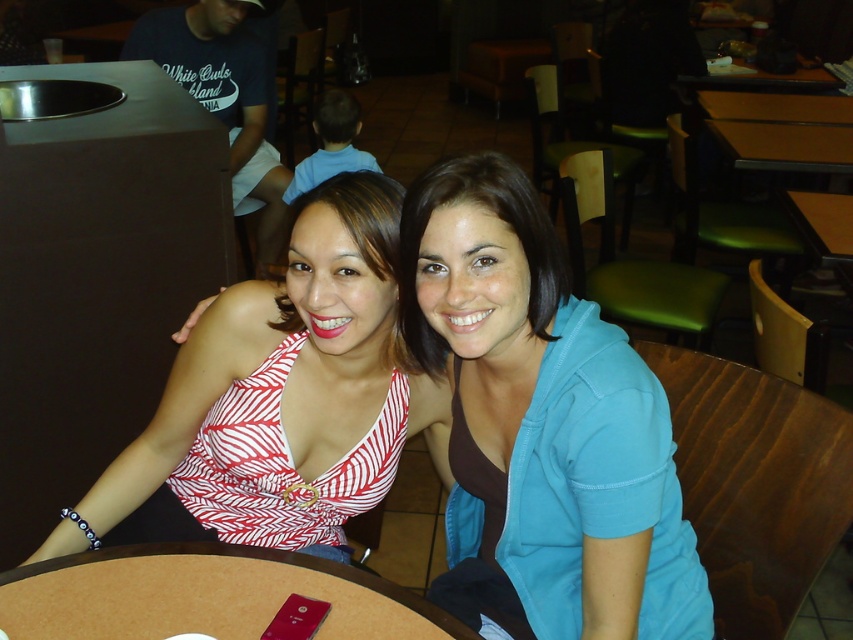
You are standing in front of the table where the two women are sitting. There is a small red object on the table at point (x=193, y=620). If you want to reach that object without moving your feet, can you do it if your arm can extend 36 inches?

The distance between point (x=193, y=620) and the camera is 38.70 inches. Since your arm can only extend 36 inches, you cannot reach the small red object at point (x=193, y=620) without moving your feet.

You are a delivery person who needs to place a package on the nearest table to the brown wood round table at center. There is a yellow matte table at upper right. Which table should you choose?

The yellow matte table at upper right is 8.42 feet away from the brown wood round table at center. Since it is the closest table available, you should place the package on the yellow matte table at upper right.